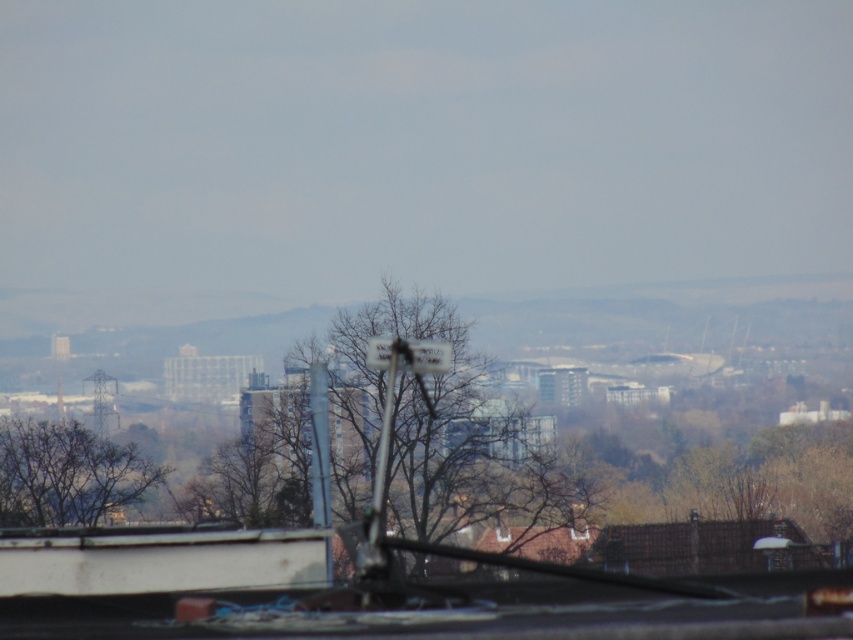
Looking at this image, who is more distant from viewer, (77, 444) or (372, 365)?

Positioned behind is point (77, 444).

Does brown leafless tree at lower left appear on the left side of white plastic street sign at center?

Correct, you'll find brown leafless tree at lower left to the left of white plastic street sign at center.

Image resolution: width=853 pixels, height=640 pixels. I want to click on brown leafless tree at lower left, so pos(67,474).